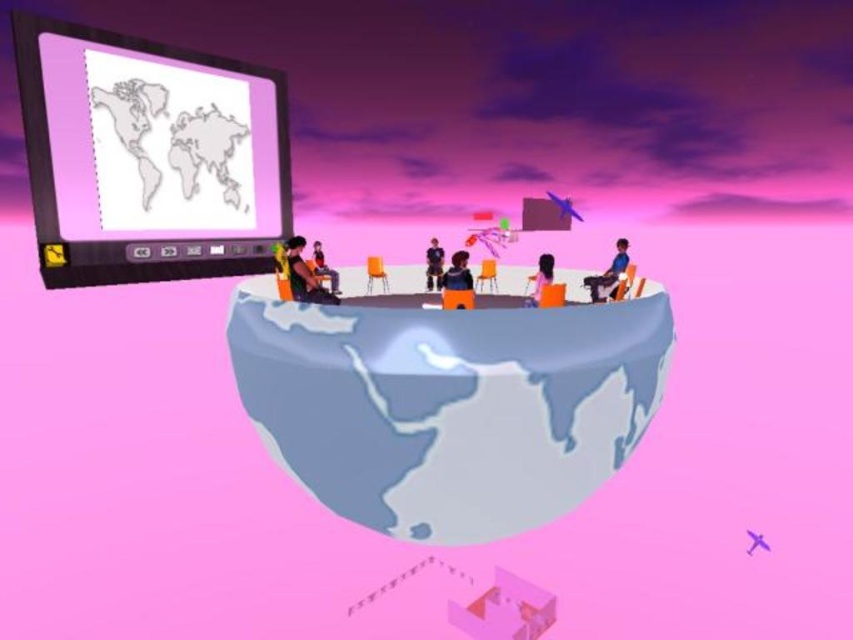
You are an astronaut floating in space near the smooth gray globe at center and the matte orange chair at center. Which object is positioned to the left?

The smooth gray globe at center is to the left of the matte orange chair at center, so the smooth gray globe at center is positioned to the left.

Based on the photo, you are an astronaut floating in space near the globe. You see the blue fabric chair at right and the matte black chair at center. Which chair is positioned higher relative to the other?

The blue fabric chair at right is above the matte black chair at center.

You are organizing a small gathering in the floating classroom and need to seat two people. You have a blue fabric chair at right and a matte black chair at center. Which chair can accommodate a taller person more comfortably?

The blue fabric chair at right is bigger than the matte black chair at center, so it can accommodate a taller person more comfortably.